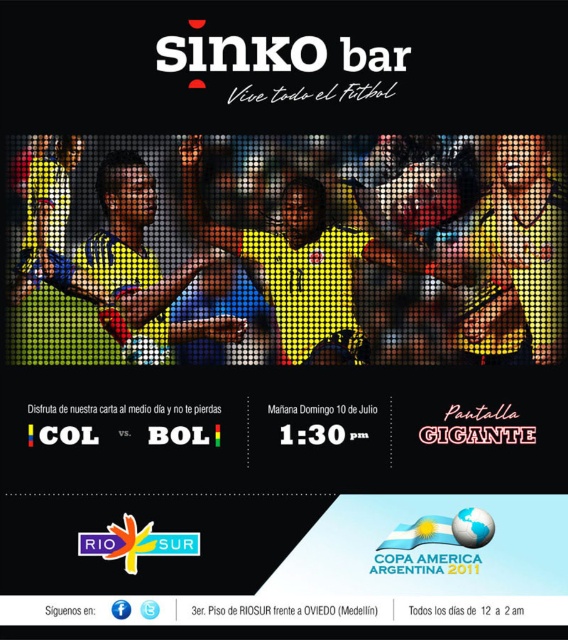
Question: Is yellow jersey at center thinner than white paper at center?

Choices:
 (A) no
 (B) yes

Answer: (A)

Question: Observing the image, what is the correct spatial positioning of yellow matte jersey at center in reference to yellow jersey at center?

Choices:
 (A) below
 (B) above

Answer: (B)

Question: Which of the following is the farthest from the observer?

Choices:
 (A) [x=160, y=304]
 (B) [x=419, y=300]

Answer: (B)

Question: Is yellow jersey at center wider than white paper at center?

Choices:
 (A) no
 (B) yes

Answer: (B)

Question: Which object is closer to the camera taking this photo?

Choices:
 (A) yellow matte jersey at center
 (B) yellow jersey at center

Answer: (B)

Question: Considering the real-world distances, which object is farthest from the yellow jersey at center?

Choices:
 (A) white paper at center
 (B) yellow matte jersey at center

Answer: (A)